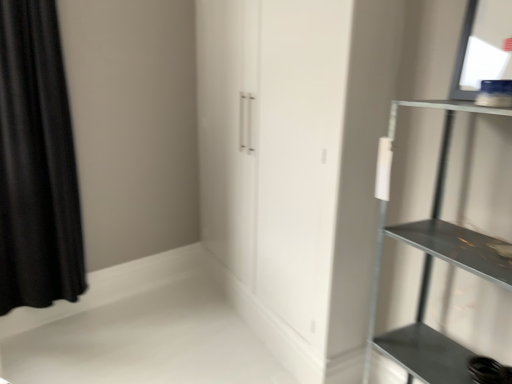
Question: Based on their positions, is metallic gray shelf at right located to the left or right of black velvet curtain at left?

Choices:
 (A) right
 (B) left

Answer: (A)

Question: Would you say metallic gray shelf at right is inside or outside black velvet curtain at left?

Choices:
 (A) inside
 (B) outside

Answer: (B)

Question: Does point (x=473, y=110) appear closer or farther from the camera than point (x=60, y=76)?

Choices:
 (A) closer
 (B) farther

Answer: (A)

Question: Considering the positions of black velvet curtain at left and metallic gray shelf at right in the image, is black velvet curtain at left wider or thinner than metallic gray shelf at right?

Choices:
 (A) wide
 (B) thin

Answer: (B)

Question: From the image's perspective, is black velvet curtain at left positioned above or below metallic gray shelf at right?

Choices:
 (A) below
 (B) above

Answer: (B)

Question: Is black velvet curtain at left spatially inside metallic gray shelf at right, or outside of it?

Choices:
 (A) inside
 (B) outside

Answer: (B)

Question: Is point (81, 249) positioned closer to the camera than point (442, 347)?

Choices:
 (A) closer
 (B) farther

Answer: (B)